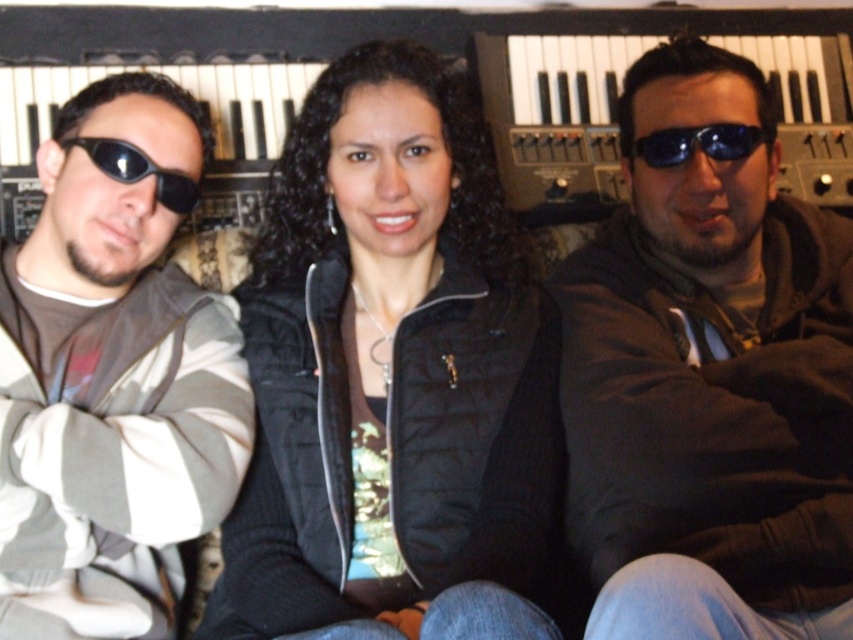
You are a photographer trying to capture a clear shot of the striped fabric jacket at left without the dark brown hoodie at center blocking it. What adjustment can you make to your camera position?

Move your camera to the right side so that the striped fabric jacket at left is no longer blocked by the dark brown hoodie at center, which is in front of it.

From the picture: You are a photographer standing at a certain distance from the dark brown hoodie at center. You want to take a closeup shot of the hoodie without moving the camera. Can you zoom in enough to capture the hoodie clearly?

The dark brown hoodie at center is 34.95 inches away from the camera. Since the camera can zoom in on objects within this distance, you can zoom in to capture the hoodie clearly.